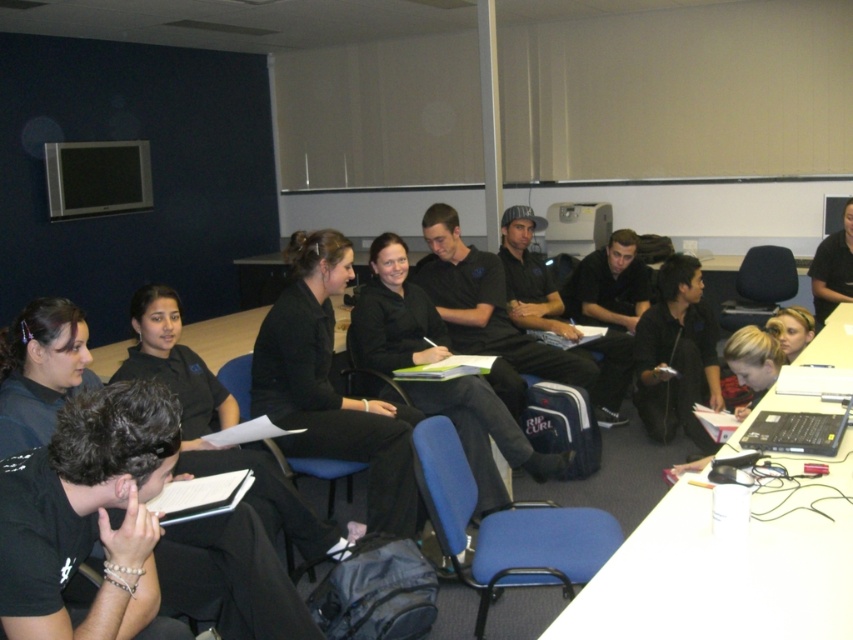
Question: Observing the image, what is the correct spatial positioning of black matte laptop at lower right in reference to black fabric shirt at upper center?

Choices:
 (A) below
 (B) above

Answer: (A)

Question: Does black matte laptop at lower right have a greater width compared to black fabric shirt at upper center?

Choices:
 (A) no
 (B) yes

Answer: (B)

Question: Which object is farther from the camera taking this photo?

Choices:
 (A) black matte/black uniform at center
 (B) black matte laptop at lower right

Answer: (A)

Question: Among these objects, which one is nearest to the camera?

Choices:
 (A) black fabric shirt at upper center
 (B) black matte/black uniform at center
 (C) black matte/black fabric pants at center
 (D) black matte laptop at lower right

Answer: (D)

Question: Does black matte/black uniform at center have a smaller size compared to black fabric shirt at upper center?

Choices:
 (A) yes
 (B) no

Answer: (B)

Question: Which is farther from the black fabric shirt at upper center?

Choices:
 (A) black matte/black uniform at center
 (B) black matte laptop at lower right

Answer: (B)